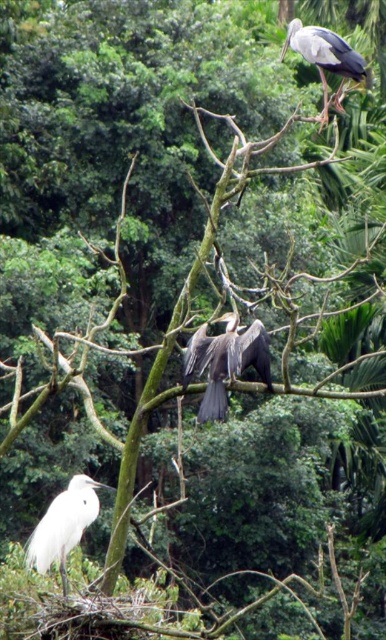
Question: Can you confirm if dark brown feathers at center is positioned above white feathered bird at lower left?

Choices:
 (A) yes
 (B) no

Answer: (A)

Question: Among these objects, which one is nearest to the camera?

Choices:
 (A) gray matte bird at upper right
 (B) dark brown feathers at center

Answer: (B)

Question: Is dark brown feathers at center positioned before gray matte bird at upper right?

Choices:
 (A) no
 (B) yes

Answer: (B)

Question: Does dark brown feathers at center appear on the right side of white feathered bird at lower left?

Choices:
 (A) no
 (B) yes

Answer: (B)

Question: Based on their relative distances, which object is nearer to the dark brown feathers at center?

Choices:
 (A) white feathered bird at lower left
 (B) gray matte bird at upper right

Answer: (A)

Question: Which object is positioned farthest from the dark brown feathers at center?

Choices:
 (A) gray matte bird at upper right
 (B) white feathered bird at lower left

Answer: (A)